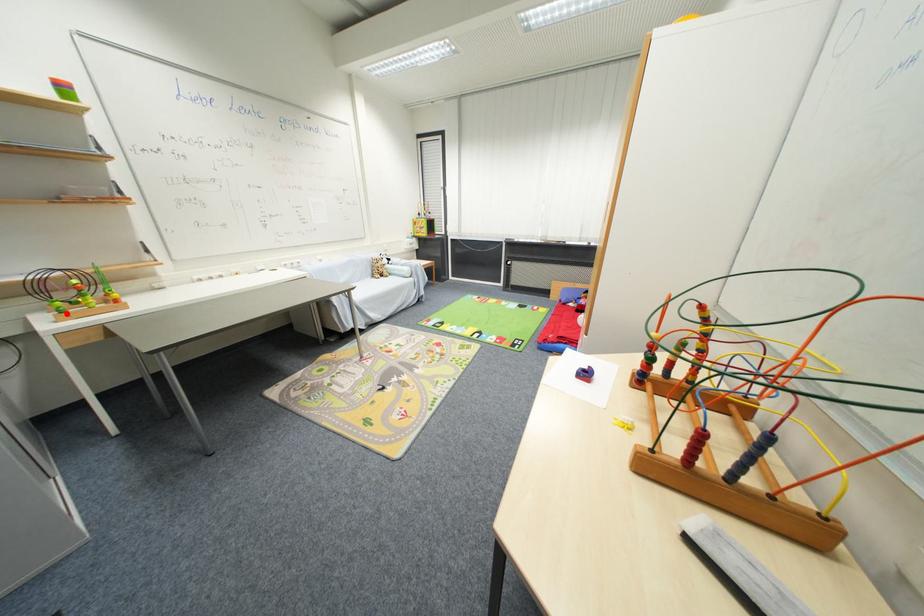
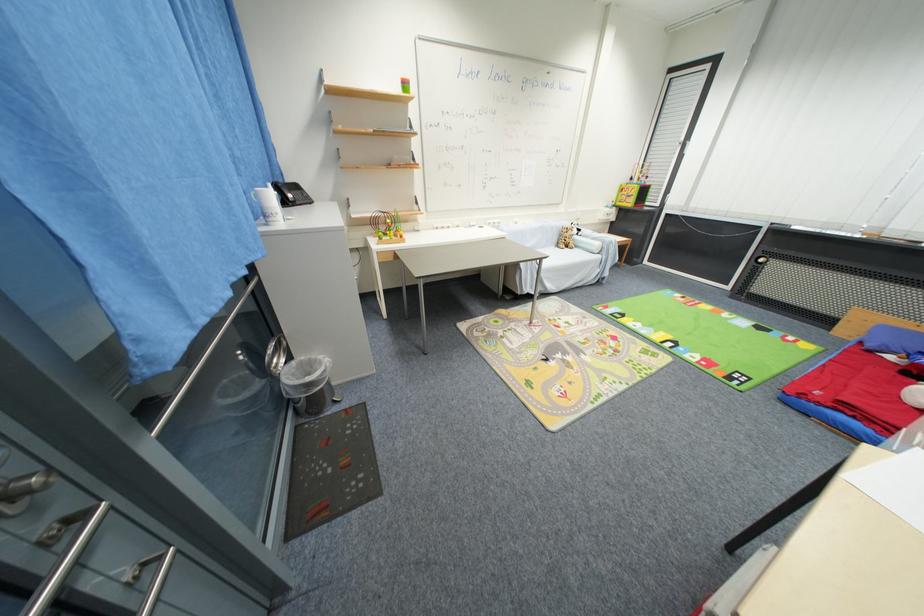
Where in the second image is the point corresponding to the highlighted location from the first image?

(385, 241)